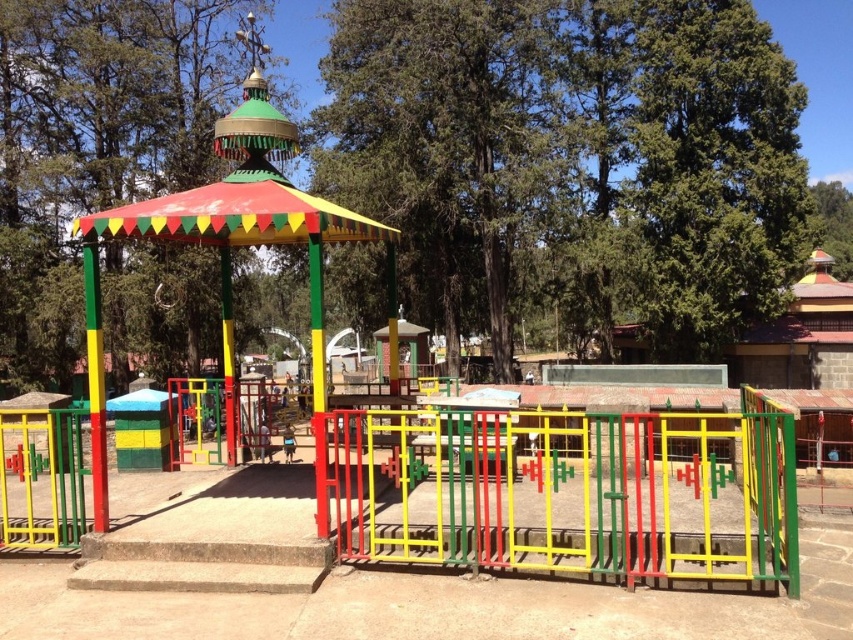
Question: Based on their relative distances, which object is farther from the multicolored painted gazebo at center?

Choices:
 (A) metallic painted gate at center
 (B) green painted wood gazebo at center

Answer: (B)

Question: Is green painted wood gazebo at center thinner than multicolored painted gazebo at center?

Choices:
 (A) no
 (B) yes

Answer: (A)

Question: Can you confirm if metallic painted gate at center is positioned to the right of multicolored painted gazebo at center?

Choices:
 (A) no
 (B) yes

Answer: (B)

Question: Which point is farther from the camera taking this photo?

Choices:
 (A) (77, 284)
 (B) (96, 429)

Answer: (A)

Question: Which is nearer to the multicolored painted gazebo at center?

Choices:
 (A) metallic painted gate at center
 (B) green painted wood gazebo at center

Answer: (A)

Question: Does metallic painted gate at center have a smaller size compared to green painted wood gazebo at center?

Choices:
 (A) no
 (B) yes

Answer: (B)